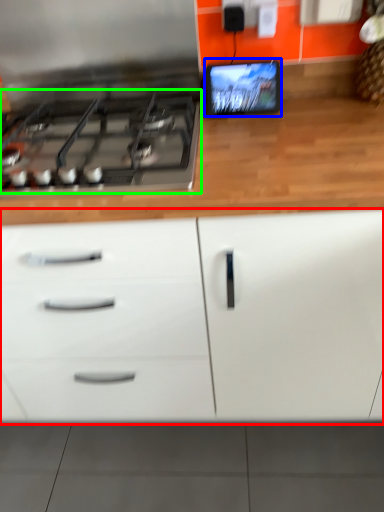
Question: Which object is positioned farthest from cabinetry (highlighted by a red box)? Select from computer monitor (highlighted by a blue box) and gas stove (highlighted by a green box).

Choices:
 (A) computer monitor
 (B) gas stove

Answer: (A)